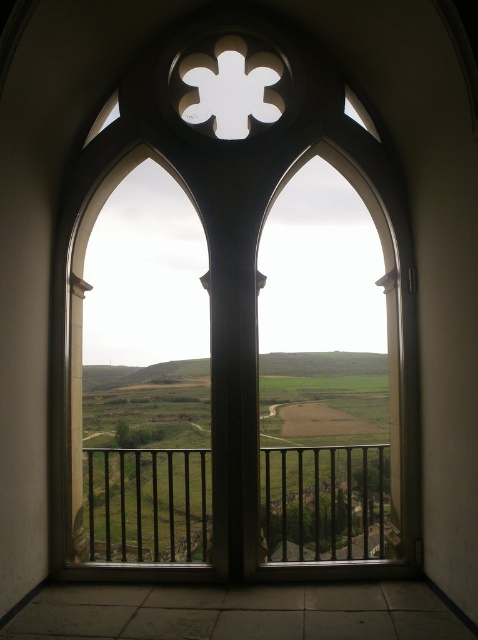
You are standing on a balcony looking through the gothic window. There are two points marked on the railing in front of you. One is at coordinates point (371, 480) and the other at point (291, 545). Which point is closer to you?

Point (371, 480) is closer to you because it is further to the viewer than point (291, 545).

You are standing in a room with a gothic window. You want to look outside through the clear glass window at center. Where should you position yourself to see the entire scene outside?

You should position yourself directly in front of the clear glass window at center located at point coordinates (235, 330) to see the entire scene outside.